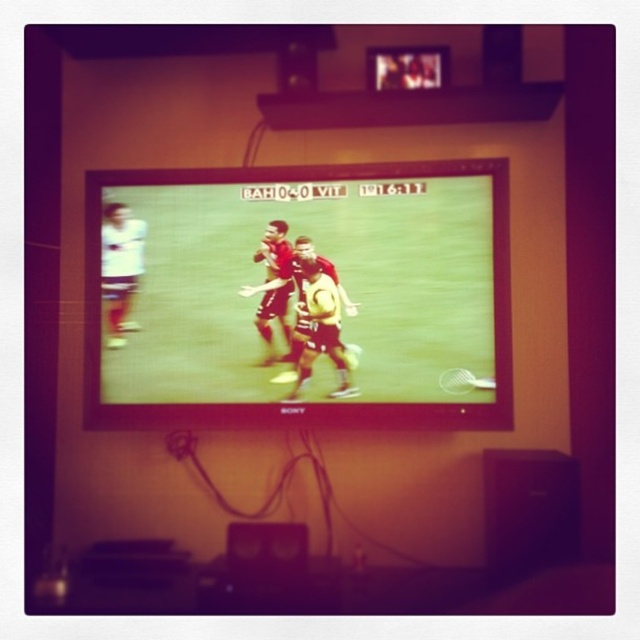
Question: Which object is farther from the camera taking this photo?

Choices:
 (A) matte plastic television at center
 (B) yellow jersey at center

Answer: (B)

Question: From the image, what is the correct spatial relationship of matte plastic television at center in relation to yellow jersey at center?

Choices:
 (A) below
 (B) above

Answer: (B)

Question: Which object is farther from the camera taking this photo?

Choices:
 (A) yellow jersey at center
 (B) matte plastic television at center

Answer: (A)

Question: Does matte plastic television at center have a smaller size compared to yellow jersey at center?

Choices:
 (A) yes
 (B) no

Answer: (B)

Question: Does matte plastic television at center appear on the left side of yellow jersey at center?

Choices:
 (A) yes
 (B) no

Answer: (A)

Question: Which of the following is the closest to the observer?

Choices:
 (A) yellow jersey at center
 (B) matte plastic television at center

Answer: (B)